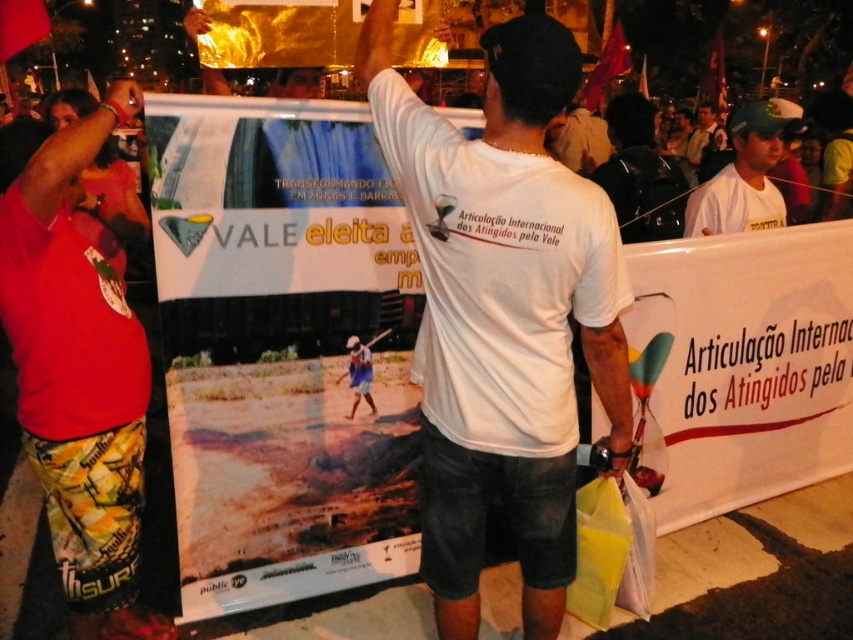
You are a photographer at the protest scene. You want to take a photo that includes both the black matte backpack at upper center and the green cap at upper right. Based on their positions, which object should you ensure is placed higher in the frame?

The black matte backpack at upper center is above the green cap at upper right, so you should ensure the black matte backpack at upper center is placed higher in the frame to include both objects.

You are a photographer trying to capture the protest scene. You notice two points in the image at coordinates point (785, 275) and point (492, 442). Which point is closer to your camera?

Point (492, 442) is closer to the camera than point (785, 275).